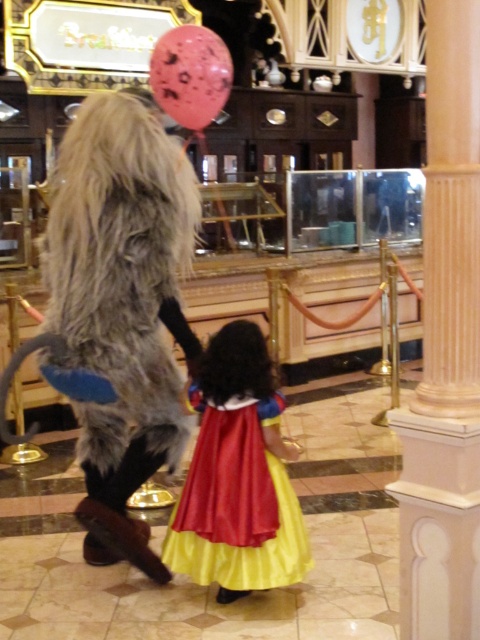
Question: Does shiny satin dress at center appear on the left side of pink dotted balloon at upper center?

Choices:
 (A) yes
 (B) no

Answer: (B)

Question: Among these points, which one is nearest to the camera?

Choices:
 (A) (216, 67)
 (B) (430, 502)
 (C) (277, 436)

Answer: (B)

Question: Which object appears closest to the camera in this image?

Choices:
 (A) white marble column at center
 (B) pink dotted balloon at upper center

Answer: (A)

Question: Does white marble column at center appear under pink dotted balloon at upper center?

Choices:
 (A) no
 (B) yes

Answer: (B)

Question: Can you confirm if shiny satin dress at center is positioned below pink dotted balloon at upper center?

Choices:
 (A) yes
 (B) no

Answer: (A)

Question: Which is farther from the white marble column at center?

Choices:
 (A) shiny satin dress at center
 (B) pink dotted balloon at upper center

Answer: (B)